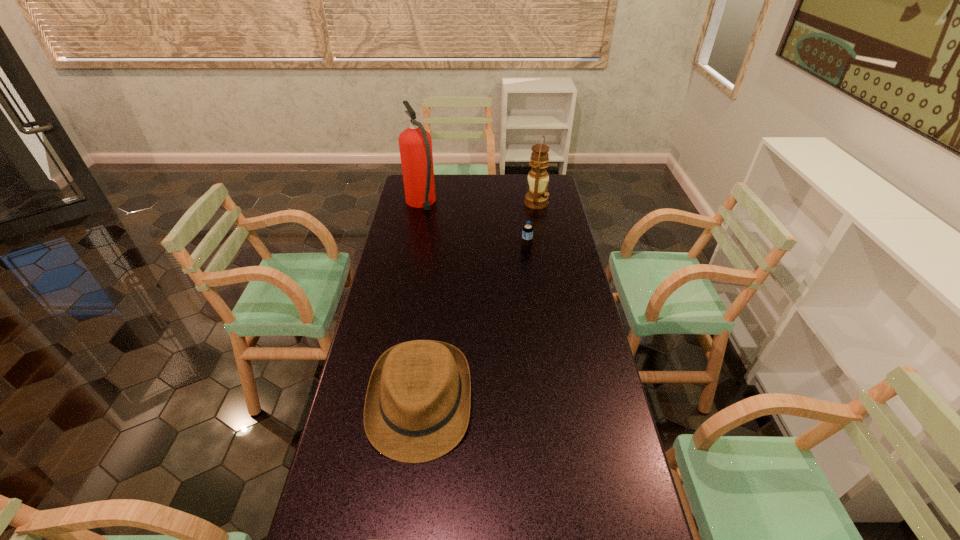
The height and width of the screenshot is (540, 960). I want to click on vacant space at the far left corner of the desktop, so click(400, 194).

You are a GUI agent. You are given a task and a screenshot of the screen. Output one action in this format:
    pyautogui.click(x=<x>, y=<y>)
    Task: Click on the free space between the fire extinguisher and the oil lamp
    The width and height of the screenshot is (960, 540).
    Given the screenshot: What is the action you would take?
    pyautogui.click(x=479, y=204)

I want to click on vacant space that's between the nearest object and the oil lamp, so click(478, 303).

Identify the location of empty space that is in between the tallest object and the soda bottle. (473, 227).

I want to click on vacant point located between the nearest object and the oil lamp, so click(x=478, y=303).

Where is `free area in between the second nearest object and the fedora`? free area in between the second nearest object and the fedora is located at coordinates (473, 326).

Where is `free space between the nearest object and the tallest object`? This screenshot has width=960, height=540. free space between the nearest object and the tallest object is located at coordinates (420, 303).

Image resolution: width=960 pixels, height=540 pixels. What are the coordinates of `free space between the fire extinguisher and the soda bottle` in the screenshot? It's located at (473, 227).

This screenshot has height=540, width=960. Find the location of `object that is the second closest to the second nearest object`. object that is the second closest to the second nearest object is located at coordinates (415, 144).

Select which object appears as the third closest to the tallest object. Please provide its 2D coordinates. Your answer should be formatted as a tuple, i.e. [(x, y)], where the tuple contains the x and y coordinates of a point satisfying the conditions above.

[(417, 407)]